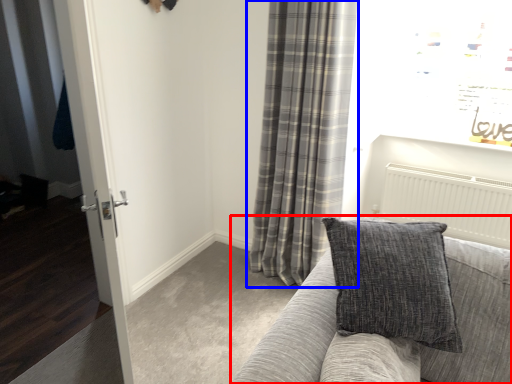
Question: Which object is closer to the camera taking this photo, studio couch (highlighted by a red box) or curtain (highlighted by a blue box)?

Choices:
 (A) studio couch
 (B) curtain

Answer: (A)